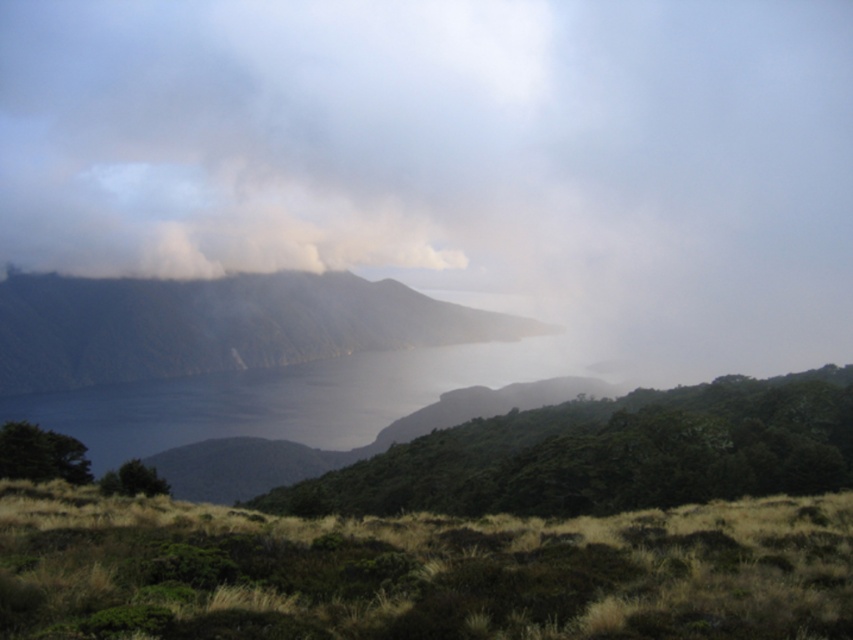
Can you confirm if white foggy cloud at upper center is thinner than green matte grass at lower center?

No, white foggy cloud at upper center is not thinner than green matte grass at lower center.

Is white foggy cloud at upper center below green matte grass at lower center?

No, white foggy cloud at upper center is not below green matte grass at lower center.

Does point (270, 225) come closer to viewer compared to point (399, 614)?

That is False.

I want to click on white foggy cloud at upper center, so pyautogui.click(x=457, y=163).

Which is behind, point (679, 525) or point (299, 362)?

Positioned behind is point (299, 362).

The height and width of the screenshot is (640, 853). What do you see at coordinates (419, 572) in the screenshot?
I see `green matte grass at lower center` at bounding box center [419, 572].

This screenshot has width=853, height=640. I want to click on green matte grass at lower center, so click(x=419, y=572).

Between white foggy cloud at upper center and dark gray rocky mountain at center, which one appears on the left side from the viewer's perspective?

dark gray rocky mountain at center

Can you confirm if white foggy cloud at upper center is bigger than dark gray rocky mountain at center?

Correct, white foggy cloud at upper center is larger in size than dark gray rocky mountain at center.

I want to click on white foggy cloud at upper center, so click(x=457, y=163).